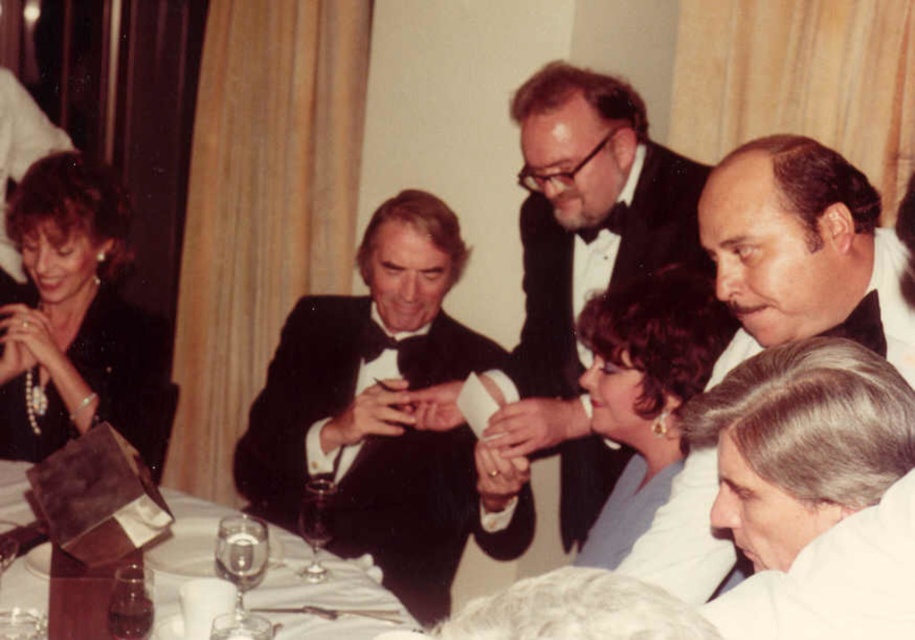
Question: Does black satin bow tie at upper right appear on the left side of white porcelain plate at center?

Choices:
 (A) yes
 (B) no

Answer: (B)

Question: Estimate the real-world distances between objects in this image. Which object is farther from the black satin tuxedo at center?

Choices:
 (A) white porcelain plate at center
 (B) white fabric at lower right

Answer: (B)

Question: Can you confirm if black satin tuxedo at upper center is positioned to the right of pearl necklace at upper left?

Choices:
 (A) no
 (B) yes

Answer: (B)

Question: Does black satin tuxedo at upper center appear on the left side of white fabric at lower right?

Choices:
 (A) no
 (B) yes

Answer: (B)

Question: Which object is the closest to the pearl necklace at upper left?

Choices:
 (A) black satin bow tie at upper right
 (B) dark brown hair at upper center
 (C) black satin tuxedo at upper center

Answer: (C)

Question: Among these points, which one is farthest from the camera?

Choices:
 (A) (385, 211)
 (B) (375, 632)

Answer: (A)